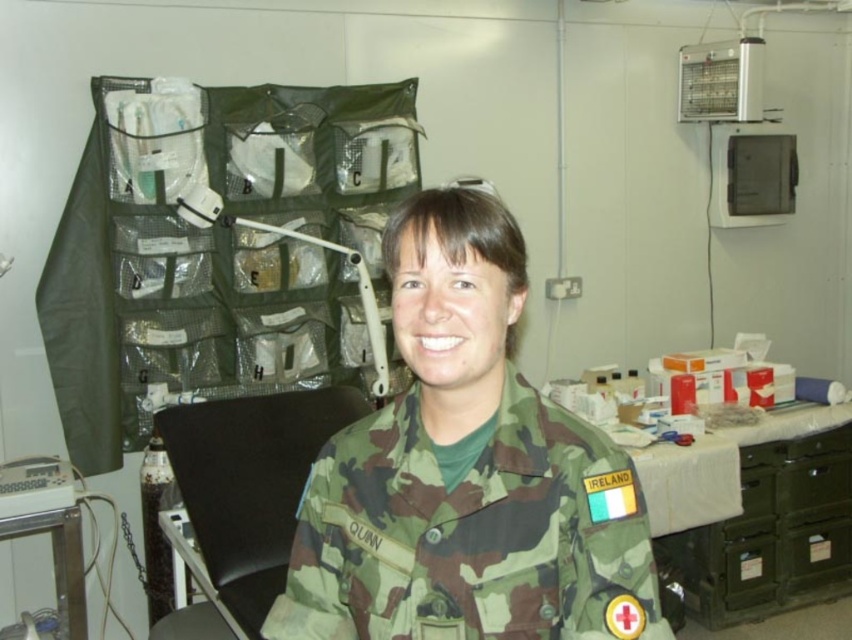
Looking at this image, you are an equipment manager in a field hospital. You need to place the camo fabric uniform at center and the white plastic monitor at lower left on a shelf. The shelf has a width of 1.2 meters. Can both items fit side by side without overlapping?

The camo fabric uniform at center might be wider than the white plastic monitor at lower left. Since the shelf is 1.2 meters wide, it depends on the combined width of both items. If the total width is less than or equal to 1.2 meters, they can fit. However, since the uniform might be wider, there is uncertainty. Please measure both items to confirm.

You are a military medic in a field hospital. You need to locate the camo fabric uniform at center to check its condition. Based on the coordinates provided, where exactly would you find it in the image?

The camo fabric uniform at center is located at the 2D coordinates point (x=471, y=532) in the image.

You are a field medic in a military operation. You need to quickly assess the equipment available. Which object is bigger, the camo fabric uniform at center or the white plastic monitor at lower left?

The camo fabric uniform at center is larger in size than the white plastic monitor at lower left, so the camo fabric uniform at center is bigger.